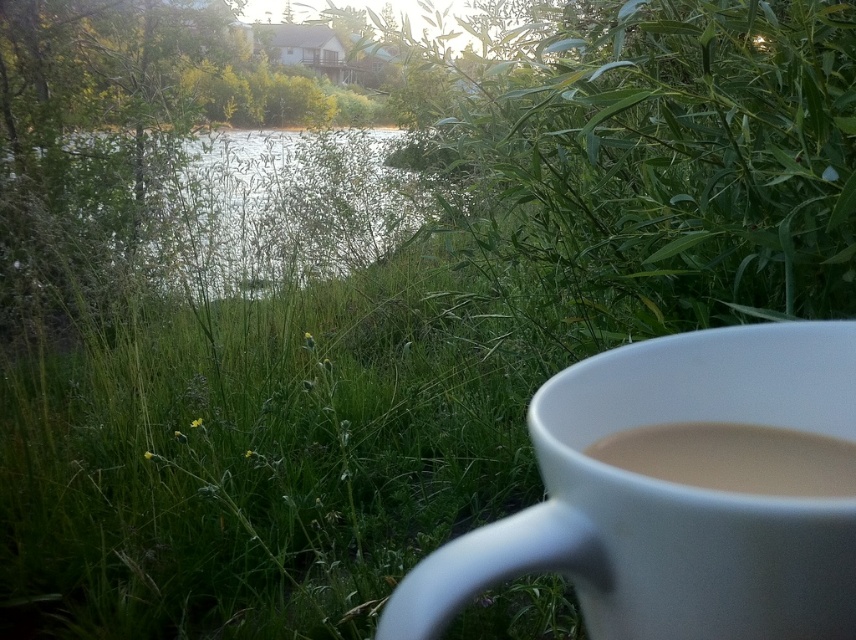
You are standing in the outdoor scene and want to reach the green grassy river at center from the white matte cup at lower right. Which direction should you move to get closer to the river?

To reach the green grassy river at center from the white matte cup at lower right, you should move away from the cup since the river is further away from the viewer than the cup.

Consider the image. You are a photographer setting up a shot of the white ceramic mug at lower right and the green grassy river at center. Which object will appear larger in your photo?

The white ceramic mug at lower right will appear larger in the photo because it is closer to the camera than the green grassy river at center.